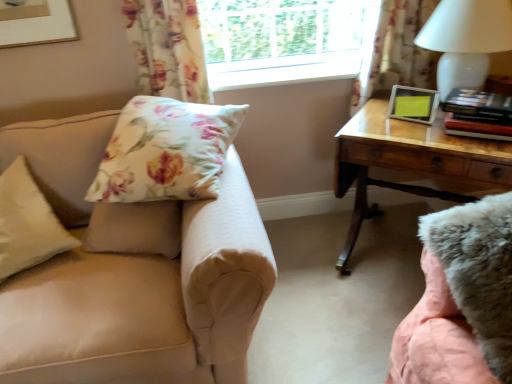
Question: Is floral fabric curtain at upper left, marked as the first curtain in a left-to-right arrangement, smaller than transparent glass window at upper center?

Choices:
 (A) yes
 (B) no

Answer: (A)

Question: Considering the relative sizes of floral fabric curtain at upper left, marked as the first curtain in a left-to-right arrangement, and transparent glass window at upper center in the image provided, is floral fabric curtain at upper left, marked as the first curtain in a left-to-right arrangement, taller than transparent glass window at upper center?

Choices:
 (A) no
 (B) yes

Answer: (B)

Question: Is floral fabric curtain at upper left, which is the second curtain from right to left, completely or partially outside of transparent glass window at upper center?

Choices:
 (A) no
 (B) yes

Answer: (B)

Question: Does floral fabric curtain at upper left, marked as the first curtain in a left-to-right arrangement, appear on the right side of transparent glass window at upper center?

Choices:
 (A) no
 (B) yes

Answer: (A)

Question: Considering the relative sizes of floral fabric curtain at upper left, marked as the first curtain in a left-to-right arrangement, and transparent glass window at upper center in the image provided, is floral fabric curtain at upper left, marked as the first curtain in a left-to-right arrangement, shorter than transparent glass window at upper center?

Choices:
 (A) yes
 (B) no

Answer: (B)

Question: From the image's perspective, is floral fabric curtain at upper left, marked as the first curtain in a left-to-right arrangement, beneath transparent glass window at upper center?

Choices:
 (A) no
 (B) yes

Answer: (B)

Question: Does beige fabric pillow at left, arranged as the 1th pillow when viewed from the left, appear on the left side of beige fabric couch at left?

Choices:
 (A) yes
 (B) no

Answer: (A)

Question: Is beige fabric pillow at left, arranged as the 1th pillow when viewed from the left, bigger than beige fabric couch at left?

Choices:
 (A) no
 (B) yes

Answer: (A)

Question: Does beige fabric pillow at left, which appears as the 2th pillow when viewed from the right, have a lesser height compared to beige fabric couch at left?

Choices:
 (A) no
 (B) yes

Answer: (B)

Question: Does beige fabric pillow at left, which appears as the 2th pillow when viewed from the right, appear on the right side of beige fabric couch at left?

Choices:
 (A) no
 (B) yes

Answer: (A)

Question: From the image's perspective, does beige fabric pillow at left, which appears as the 2th pillow when viewed from the right, appear lower than beige fabric couch at left?

Choices:
 (A) yes
 (B) no

Answer: (B)

Question: Is beige fabric pillow at left, arranged as the 1th pillow when viewed from the left, in front of beige fabric couch at left?

Choices:
 (A) no
 (B) yes

Answer: (A)

Question: Is hardcover books at right inside wooden desk at right?

Choices:
 (A) no
 (B) yes

Answer: (A)